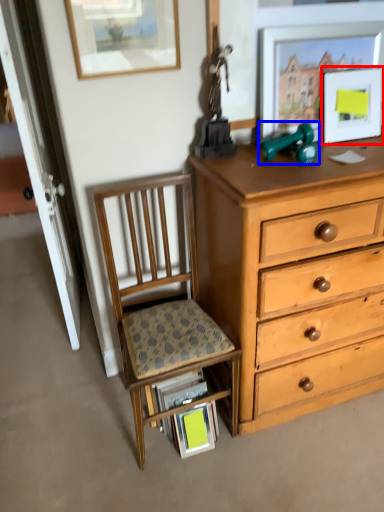
Question: Which point is closer to the camera, picture frame (highlighted by a red box) or toy (highlighted by a blue box)?

Choices:
 (A) picture frame
 (B) toy

Answer: (B)